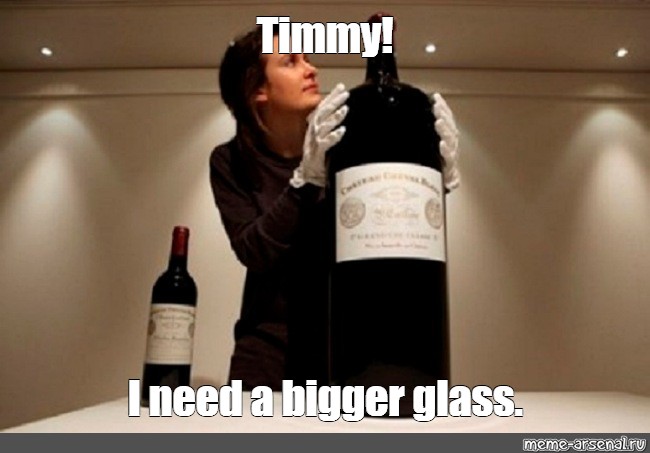
In order to click on wine bottle in this screenshot , I will do `click(174, 293)`, `click(400, 303)`.